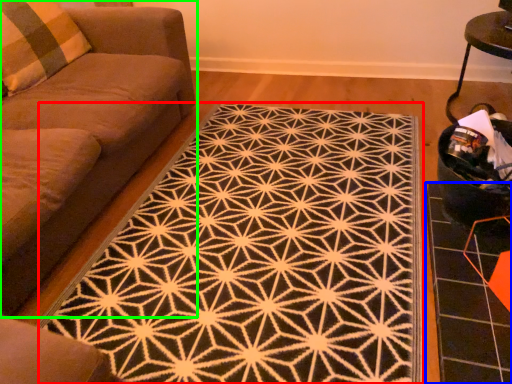
Question: Which object is the closest to the mat (highlighted by a red box)? Choose among these: tile (highlighted by a blue box) or studio couch (highlighted by a green box).

Choices:
 (A) tile
 (B) studio couch

Answer: (A)